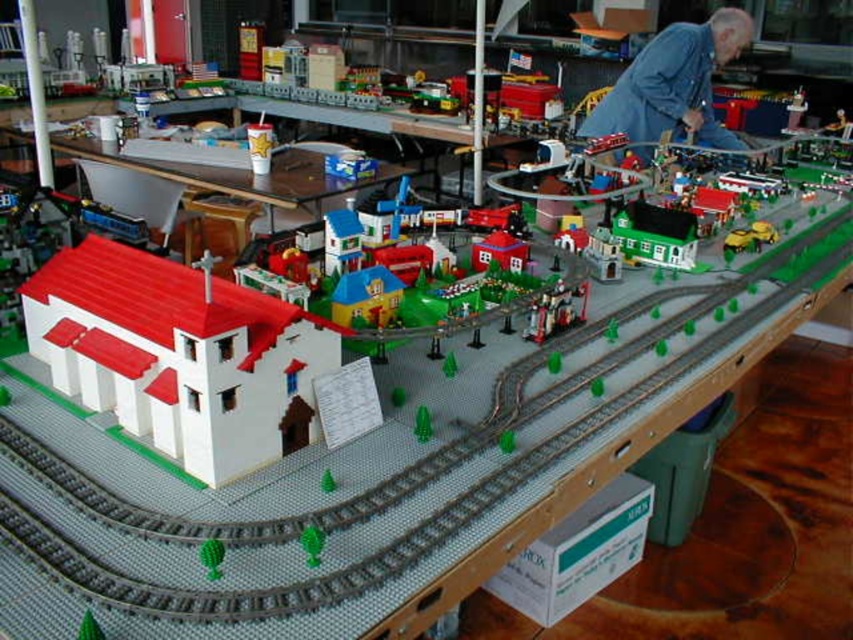
What are the coordinates of `green matte ball at lower left` in the screenshot? It's located at (212, 556).

What do you see at coordinates (212, 556) in the screenshot? The image size is (853, 640). I see `green matte ball at lower left` at bounding box center [212, 556].

Find the location of a particular element. The image size is (853, 640). green matte ball at lower left is located at coordinates (212, 556).

Does point (659, 216) come farther from viewer compared to point (555, 307)?

That is True.

This screenshot has width=853, height=640. What do you see at coordinates (654, 234) in the screenshot?
I see `green matte house at center` at bounding box center [654, 234].

This screenshot has height=640, width=853. Identify the location of green matte house at center. (654, 234).

Find the location of a particular element. This screenshot has height=640, width=853. green matte house at center is located at coordinates (654, 234).

Between smooth gray train track at center and white matte church at lower left, which one has more height?

Standing taller between the two is smooth gray train track at center.

Is smooth gray train track at center to the right of white matte church at lower left from the viewer's perspective?

Indeed, smooth gray train track at center is positioned on the right side of white matte church at lower left.

You are a GUI agent. You are given a task and a screenshot of the screen. Output one action in this format:
    pyautogui.click(x=<x>, y=<y>)
    Task: Click on the smooth gray train track at center
    This screenshot has height=640, width=853.
    Given the screenshot: What is the action you would take?
    pyautogui.click(x=379, y=476)